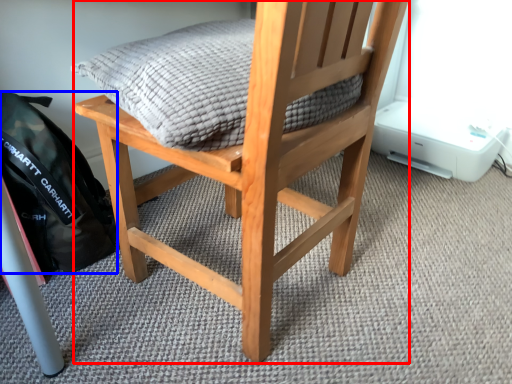
Question: Among these objects, which one is farthest to the camera, chair (highlighted by a red box) or backpack (highlighted by a blue box)?

Choices:
 (A) chair
 (B) backpack

Answer: (B)